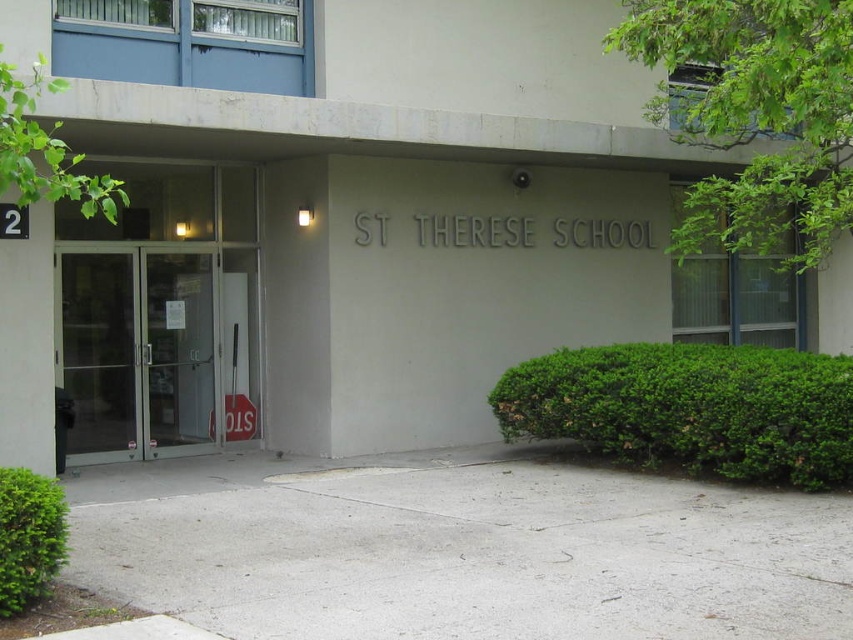
The height and width of the screenshot is (640, 853). I want to click on green leafy tree at upper right, so click(753, 115).

Does green leafy tree at upper right have a smaller size compared to clear glass window at upper right?

No.

Identify the location of green leafy tree at upper right. (753, 115).

The width and height of the screenshot is (853, 640). Identify the location of green leafy tree at upper right. [x=753, y=115].

The width and height of the screenshot is (853, 640). In order to click on green leafy bush at lower right in this screenshot , I will do `click(689, 408)`.

Between green leafy bush at lower right and green leafy hedge at lower left, which one has less height?

With less height is green leafy hedge at lower left.

Measure the distance between point (814, 378) and camera.

26.33 feet

Where is `green leafy bush at lower right`? The height and width of the screenshot is (640, 853). green leafy bush at lower right is located at coordinates (689, 408).

Between green leafy bush at lower right and transparent glass doors at center, which one has more height?

With more height is transparent glass doors at center.

Does point (727, 401) lie in front of point (120, 420)?

That is True.

Image resolution: width=853 pixels, height=640 pixels. In order to click on green leafy bush at lower right in this screenshot , I will do `click(689, 408)`.